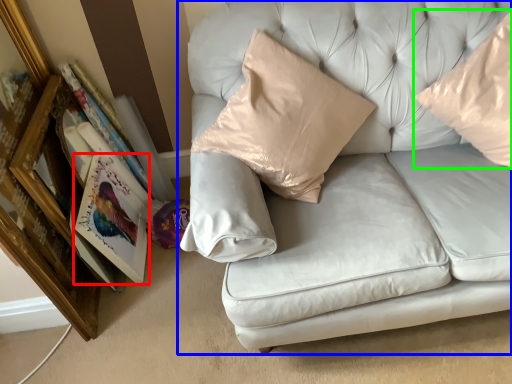
Question: Which object is positioned closest to paperback book (highlighted by a red box)? Select from studio couch (highlighted by a blue box) and pillow (highlighted by a green box).

Choices:
 (A) studio couch
 (B) pillow

Answer: (A)